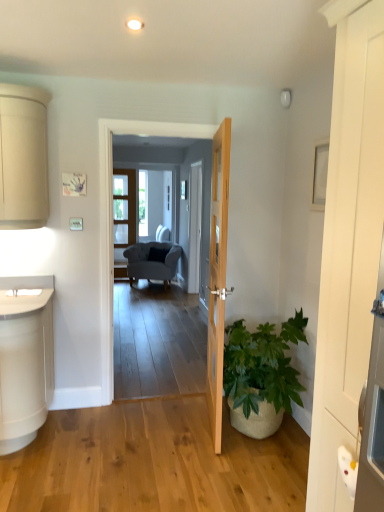
The width and height of the screenshot is (384, 512). In order to click on free region under green leafy plant in woven basket at lower right (from a real-world perspective) in this screenshot , I will do `click(267, 439)`.